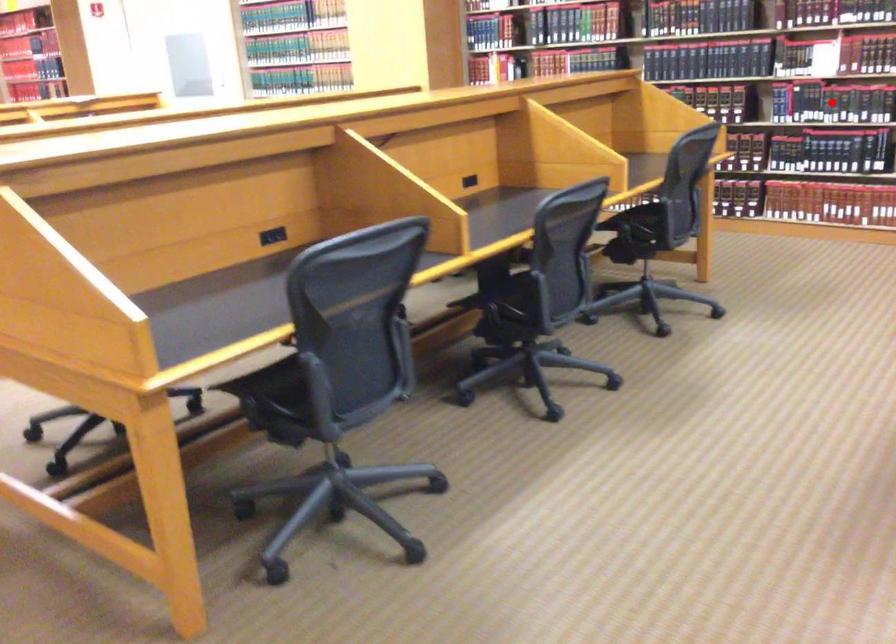
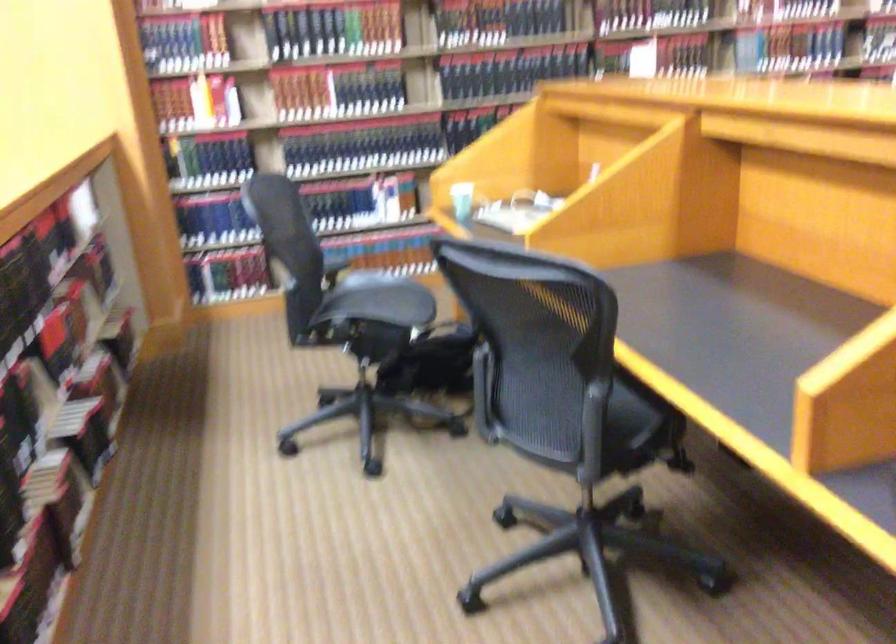
Question: I am providing you with two images of the same scene from different viewpoints. A red point is marked on the first image. Is the red point's position out of view in image 2?

Choices:
 (A) Yes
 (B) No

Answer: (A)